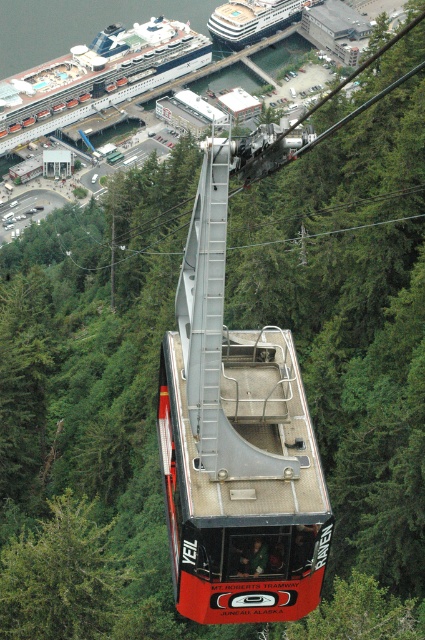
Question: Does red matte cable car at center have a lesser width compared to white glossy cruise ship at upper left?

Choices:
 (A) yes
 (B) no

Answer: (A)

Question: Among these objects, which one is nearest to the camera?

Choices:
 (A) red matte cable car at center
 (B) white glossy cruise ship at upper left
 (C) green leafy tree at center

Answer: (A)

Question: Is red matte cable car at center to the left of white glossy cruise ship at upper left from the viewer's perspective?

Choices:
 (A) no
 (B) yes

Answer: (A)

Question: Does green leafy tree at center appear under white glossy cruise ship at upper left?

Choices:
 (A) yes
 (B) no

Answer: (A)

Question: Which object is closer to the camera taking this photo?

Choices:
 (A) white glossy cruise ship at upper left
 (B) green leafy tree at center

Answer: (B)

Question: Among these objects, which one is farthest from the camera?

Choices:
 (A) white glossy cruise ship at upper left
 (B) green leafy tree at center
 (C) red matte cable car at center

Answer: (A)